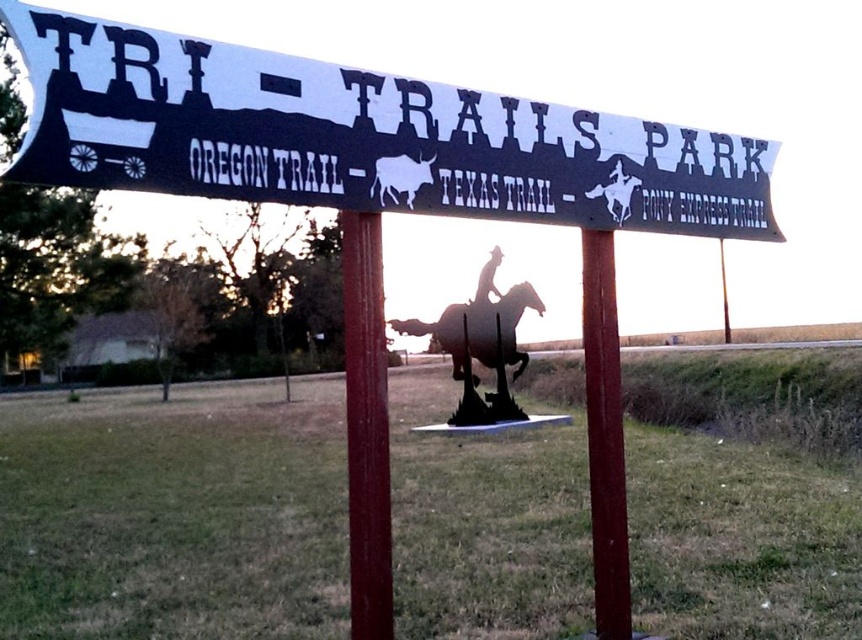
You are standing in Tri Trails Park and want to locate the black metal sign at upper center. According to the map, where should you look relative to the cowboy silhouette in the foreground?

The black metal sign at upper center is located at coordinates (360,138), which is above the cowboy silhouette in the foreground.

You are a park visitor who wants to take a photo of the black metal sign at upper center and the red painted wood post at center. Since you want both objects in the frame, which one should you focus on to ensure both are visible?

You should focus on the red painted wood post at center because the black metal sign at upper center is shorter than it, so adjusting the camera angle to include the taller post will naturally include the shorter sign in the frame.

You are standing in Tri Trails Park and want to locate the black metal sign at upper center. According to the map coordinates, where should you look?

The black metal sign at upper center is located at point (360, 138).